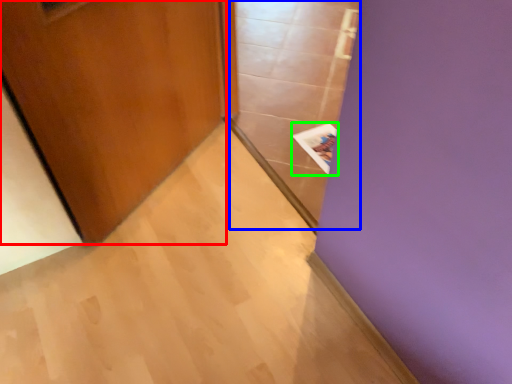
Question: Which object is positioned farthest from door (highlighted by a red box)? Select from glass door (highlighted by a blue box) and magazine (highlighted by a green box).

Choices:
 (A) glass door
 (B) magazine

Answer: (B)